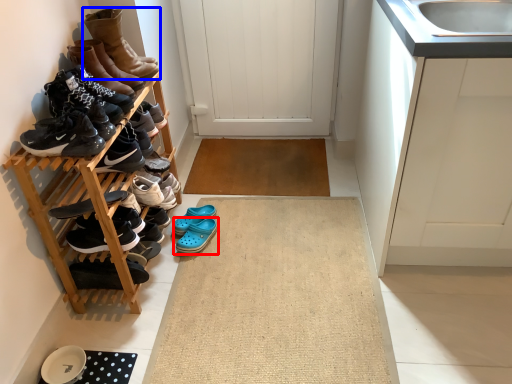
Question: Which object is closer to the camera taking this photo, footwear (highlighted by a red box) or footwear (highlighted by a blue box)?

Choices:
 (A) footwear
 (B) footwear

Answer: (B)